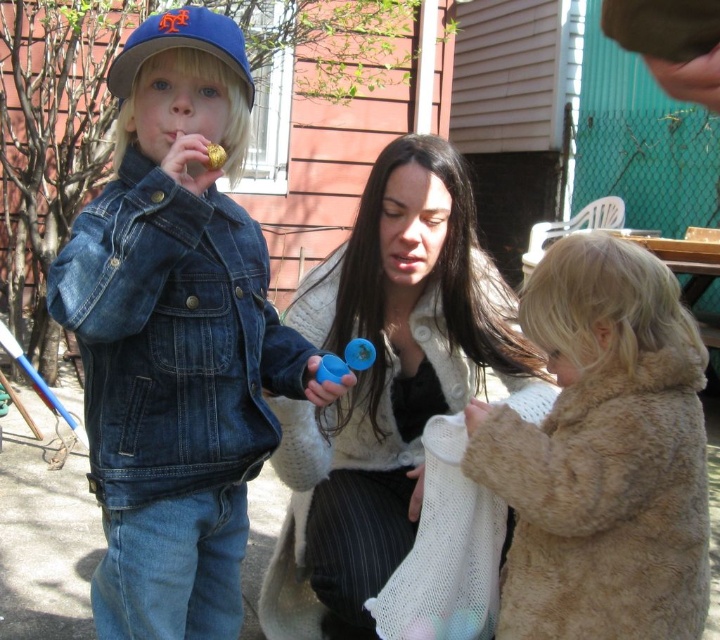
Question: Which of the following is the farthest from the observer?

Choices:
 (A) white fuzzy coat at center
 (B) blue matte baseball cap at upper left
 (C) blue plastic toy at center

Answer: (A)

Question: Is denim jacket at left positioned at the back of white fuzzy coat at center?

Choices:
 (A) yes
 (B) no

Answer: (B)

Question: Estimate the real-world distances between objects in this image. Which object is farther from the blue matte baseball cap at upper left?

Choices:
 (A) gold shiny candy at center
 (B) white fuzzy coat at center

Answer: (B)

Question: Does denim jacket at left lie behind white fuzzy coat at center?

Choices:
 (A) no
 (B) yes

Answer: (A)

Question: Among these points, which one is farthest from the camera?

Choices:
 (A) (217, 156)
 (B) (626, 420)
 (C) (222, 268)
 (D) (204, 44)

Answer: (C)

Question: Can you confirm if white fuzzy coat at center is wider than blue matte baseball cap at upper left?

Choices:
 (A) yes
 (B) no

Answer: (A)